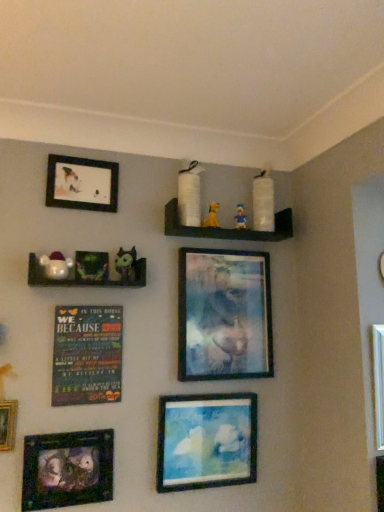
Question: From the image's perspective, is green rubber donut at upper center, the 2th toy viewed from the left, located above or below yellow fabric dog at upper center, marked as the 2th toy in a right-to-left arrangement?

Choices:
 (A) above
 (B) below

Answer: (B)

Question: Based on their positions, is green rubber donut at upper center, arranged as the third toy when viewed from the right, located to the left or right of yellow fabric dog at upper center, the 2th toy viewed from the back?

Choices:
 (A) left
 (B) right

Answer: (A)

Question: Which object is positioned closest to the white glossy plush toy at left, the fourth toy positioned from the right?

Choices:
 (A) matte black picture frame at upper left, marked as the 2th picture frame in a left-to-right arrangement
 (B) metallic silver picture frame at upper center, positioned as the fifth picture frame in left-to-right order
 (C) matte blue painting at lower center, the third picture frame viewed from the left
 (D) multicolored wooden plaque at center-left
 (E) yellow fabric dog at upper center, the 2th toy viewed from the back

Answer: (D)

Question: Considering the real-world distances, which object is farthest from the matte black picture frame at upper left, positioned as the 4th picture frame in right-to-left order?

Choices:
 (A) blue fabric toy at upper center, the 4th toy when ordered from left to right
 (B) metallic silver frame at lower left, the fifth picture frame when ordered from right to left
 (C) metallic green figurines at left, the second shelf when ordered from right to left
 (D) white glossy plush toy at left, the fourth toy positioned from the right
 (E) metallic silver picture frame at upper center, acting as the first picture frame starting from the right

Answer: (E)